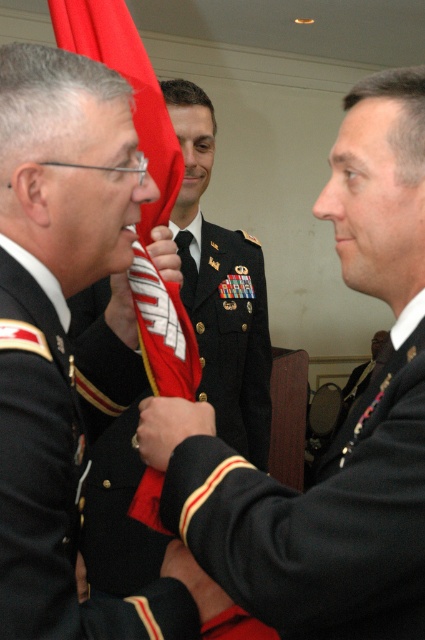
Question: Is black matte uniform at center to the right of dark green fabric uniform at center from the viewer's perspective?

Choices:
 (A) no
 (B) yes

Answer: (B)

Question: Which point is farther from the camera taking this photo?

Choices:
 (A) (252, 420)
 (B) (407, 346)
 (C) (76, 49)

Answer: (A)

Question: Estimate the real-world distances between objects in this image. Which object is closer to the white fabric at center?

Choices:
 (A) dark green fabric uniform at center
 (B) shiny black uniform at left

Answer: (B)

Question: Which of the following is the farthest from the observer?

Choices:
 (A) (110, 298)
 (B) (223, 627)
 (C) (192, 576)
 (D) (370, 554)

Answer: (A)

Question: Is black matte uniform at center wider than shiny black uniform at center?

Choices:
 (A) yes
 (B) no

Answer: (B)

Question: Can you confirm if red fabric flag at center is thinner than matte black hand at center?

Choices:
 (A) yes
 (B) no

Answer: (B)